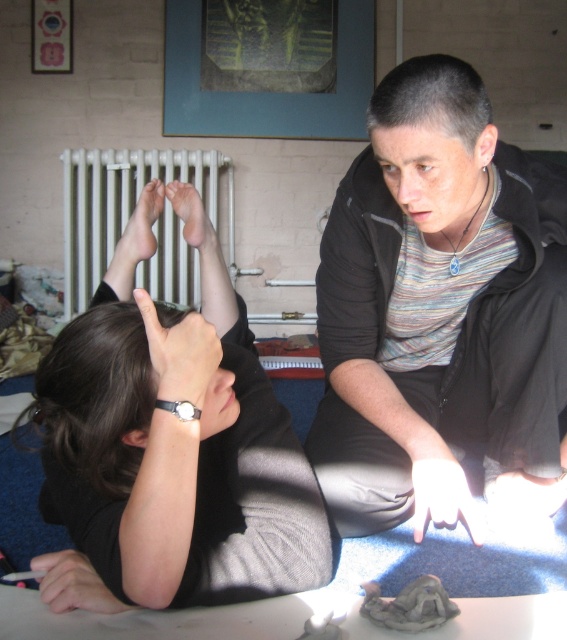
You are a physical therapist observing the white metallic radiator at upper center and the matte skin feet at upper center in the image. Which object is closer to your line of sight?

The white metallic radiator at upper center is closer to your line of sight because it is further to the viewer than the matte skin feet at upper center.

You are a physical therapist assessing the setup of this exercise. The white metallic radiator at upper center and the matte skin feet at upper center are both in the same area. Which object takes up more space in that area?

The white metallic radiator at upper center is bigger than matte skin feet at upper center, so it takes up more space in that area.

You are a physical therapist assessing the positioning of your patient. You notice the black leather watch at upper center and the white matte hand at center in the scene. Which object has a smaller width?

The black leather watch at upper center has a lesser width compared to the white matte hand at center.